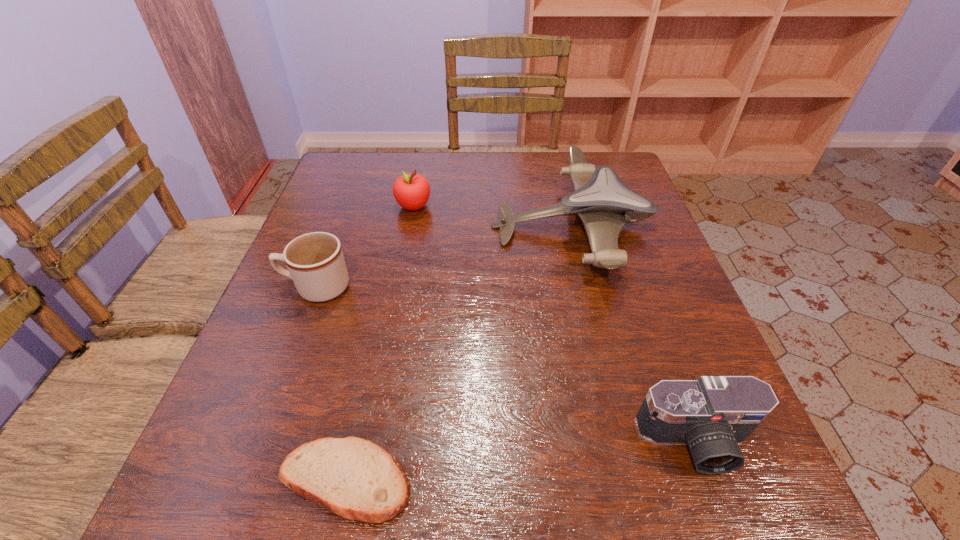
Find the location of a particular element. This screenshot has width=960, height=540. empty space that is in between the camera and the apple is located at coordinates (555, 324).

Locate an element on the screen. This screenshot has height=540, width=960. vacant space in between the pita bread and the apple is located at coordinates (379, 343).

Where is `vacant region between the drone and the apple`? vacant region between the drone and the apple is located at coordinates (492, 217).

You are a GUI agent. You are given a task and a screenshot of the screen. Output one action in this format:
    pyautogui.click(x=<x>, y=<y>)
    Task: Click on the free space between the apple and the shortest object
    The width and height of the screenshot is (960, 540).
    Given the screenshot: What is the action you would take?
    pyautogui.click(x=379, y=343)

Find the location of a particular element. Image resolution: width=960 pixels, height=540 pixels. vacant area that lies between the shortest object and the mug is located at coordinates (330, 384).

The width and height of the screenshot is (960, 540). I want to click on empty space that is in between the camera and the pita bread, so click(520, 461).

This screenshot has height=540, width=960. I want to click on the fourth closest object relative to the apple, so click(x=713, y=414).

Select which object appears as the closest to the drone. Please provide its 2D coordinates. Your answer should be formatted as a tuple, i.e. [(x, y)], where the tuple contains the x and y coordinates of a point satisfying the conditions above.

[(411, 191)]

You are a GUI agent. You are given a task and a screenshot of the screen. Output one action in this format:
    pyautogui.click(x=<x>, y=<y>)
    Task: Click on the free location that satisfies the following two spatial constraints: 1. on the front-facing side of the drone; 2. on the front side of the shortest object
    This screenshot has height=540, width=960.
    Given the screenshot: What is the action you would take?
    pyautogui.click(x=633, y=481)